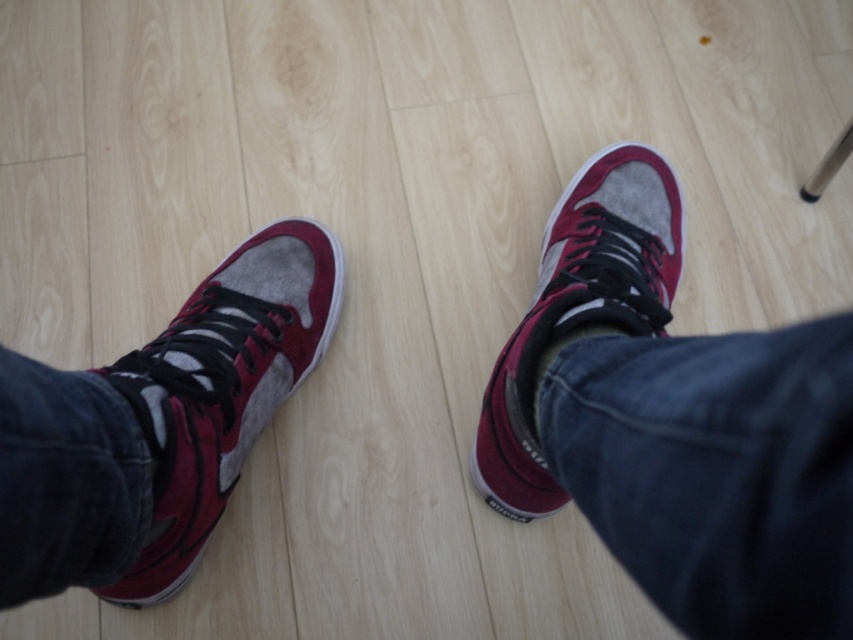
Between matte suede sneaker at right and matte suede sneaker at center, which one appears on the left side from the viewer's perspective?

From the viewer's perspective, matte suede sneaker at right appears more on the left side.

I want to click on matte suede sneaker at right, so click(x=676, y=422).

Between point (184, 476) and point (637, 225), which one is positioned in front?

Point (184, 476)

Which of these two, suede/maroon sneaker at left or matte suede sneaker at center, stands taller?

With more height is matte suede sneaker at center.

Where is `suede/maroon sneaker at left`? This screenshot has height=640, width=853. suede/maroon sneaker at left is located at coordinates (221, 387).

Is matte suede sneaker at right shorter than suede/maroon sneaker at left?

No.

Can you confirm if matte suede sneaker at right is positioned to the left of suede/maroon sneaker at left?

Incorrect, matte suede sneaker at right is not on the left side of suede/maroon sneaker at left.

Identify the location of matte suede sneaker at right. The image size is (853, 640). (676, 422).